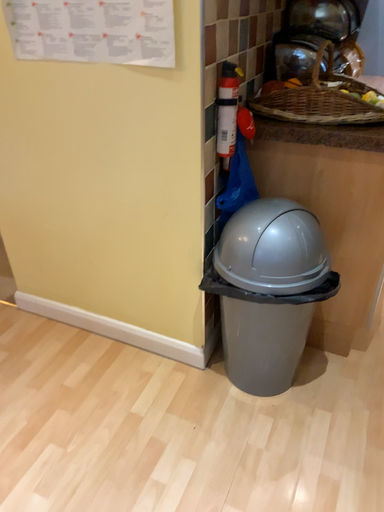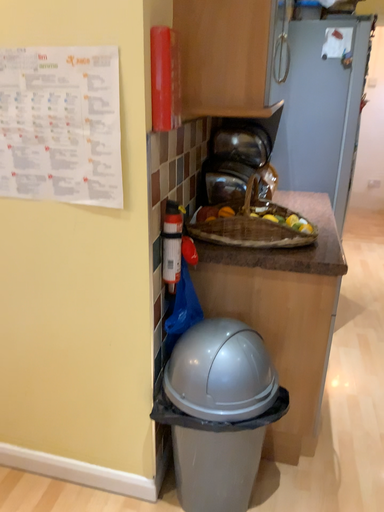
Question: Which way did the camera rotate in the video?

Choices:
 (A) rotated right
 (B) rotated left

Answer: (A)